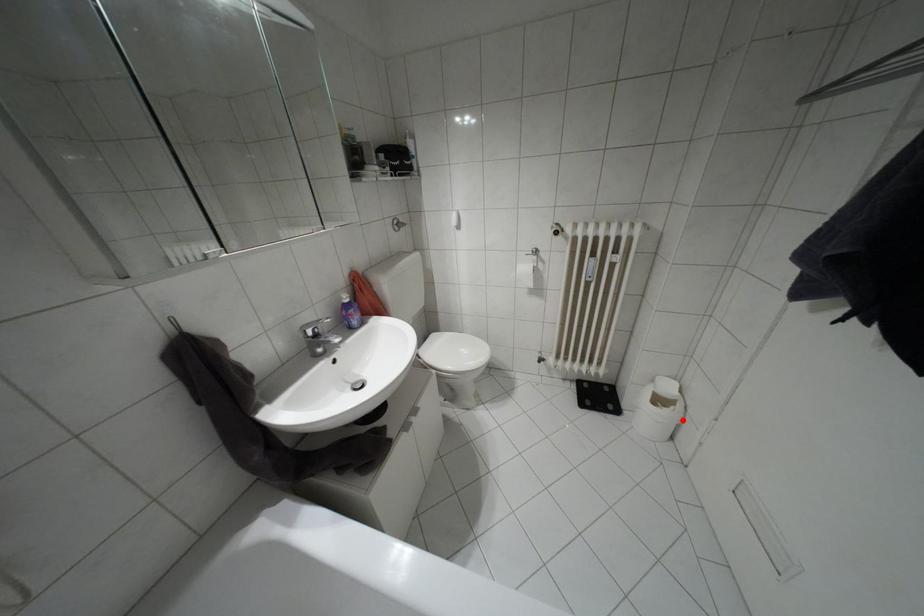
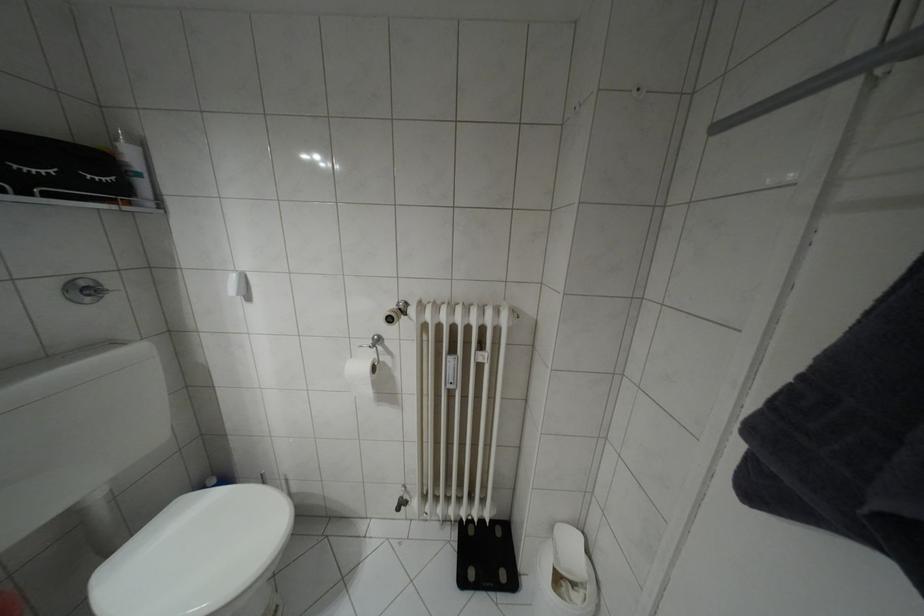
Question: I am providing you with two images of the same scene from different viewpoints. Image1 has a red point marked. In image2, the corresponding 3D location appears at what relative position? Reply with the corresponding letter.

Choices:
 (A) Closer
 (B) Farther

Answer: (A)